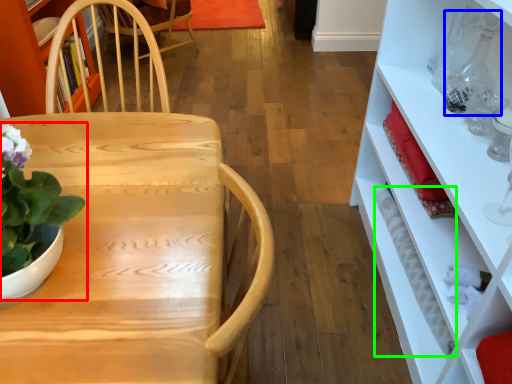
Question: Considering the real-world distances, which object is farthest from houseplant (highlighted by a red box)? bottle (highlighted by a blue box) or bottle (highlighted by a green box)?

Choices:
 (A) bottle
 (B) bottle

Answer: (A)